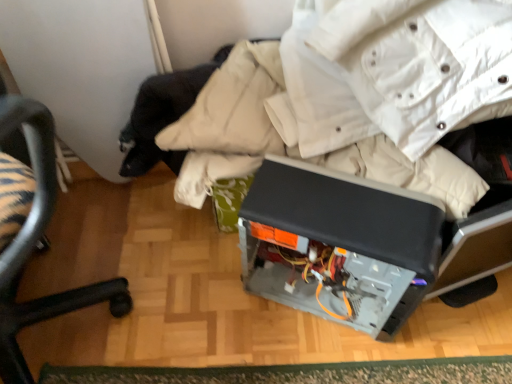
Image resolution: width=512 pixels, height=384 pixels. What do you see at coordinates (37, 242) in the screenshot?
I see `black plastic chair at lower left` at bounding box center [37, 242].

Measure the distance between green textured mat at lower center and camera.

green textured mat at lower center and camera are 38.49 inches apart.

This screenshot has width=512, height=384. What do you see at coordinates (298, 373) in the screenshot? I see `green textured mat at lower center` at bounding box center [298, 373].

Image resolution: width=512 pixels, height=384 pixels. Find the location of `satin black computer case at center`. satin black computer case at center is located at coordinates (361, 244).

From the image's perspective, is satin black computer case at center located above green textured mat at lower center?

Yes.

In the scene shown: Would you say satin black computer case at center is inside or outside green textured mat at lower center?

satin black computer case at center cannot be found inside green textured mat at lower center.

Considering the sizes of objects satin black computer case at center and green textured mat at lower center in the image provided, who is bigger, satin black computer case at center or green textured mat at lower center?

satin black computer case at center is bigger.

In terms of width, does satin black computer case at center look wider or thinner when compared to green textured mat at lower center?

satin black computer case at center is wider than green textured mat at lower center.

Could satin black computer case at center be considered to be inside black plastic chair at lower left?

No, satin black computer case at center is not surrounded by black plastic chair at lower left.

From the image's perspective, is black plastic chair at lower left positioned above or below satin black computer case at center?

black plastic chair at lower left is above satin black computer case at center.

From the picture: Relative to satin black computer case at center, is black plastic chair at lower left in front or behind?

In the image, black plastic chair at lower left appears in front of satin black computer case at center.

At what (x,y) coordinates should I click in order to perform the action: click on mat that is below the satin black computer case at center (from the image's perspective). Please return your answer as a coordinate pair (x, y). This screenshot has height=384, width=512. Looking at the image, I should click on (298, 373).

Which is more to the left, green textured mat at lower center or satin black computer case at center?

green textured mat at lower center is more to the left.

Based on the photo, how distant is green textured mat at lower center from satin black computer case at center?

A distance of 11.66 inches exists between green textured mat at lower center and satin black computer case at center.

Which object is thinner, green textured mat at lower center or satin black computer case at center?

With smaller width is green textured mat at lower center.

How many degrees apart are the facing directions of black plastic chair at lower left and green textured mat at lower center?

21.3 degrees separate the facing orientations of black plastic chair at lower left and green textured mat at lower center.

From the image's perspective, which one is positioned higher, black plastic chair at lower left or green textured mat at lower center?

black plastic chair at lower left, from the image's perspective.

Visually, is black plastic chair at lower left positioned to the left or to the right of green textured mat at lower center?

Clearly, black plastic chair at lower left is on the left of green textured mat at lower center in the image.

Who is bigger, black plastic chair at lower left or green textured mat at lower center?

Bigger between the two is black plastic chair at lower left.

Which object is positioned more to the right, green textured mat at lower center or black plastic chair at lower left?

green textured mat at lower center is more to the right.

From a real-world perspective, is green textured mat at lower center physically above black plastic chair at lower left?

Actually, green textured mat at lower center is physically below black plastic chair at lower left in the real world.

Identify the location of chair lying in front of the green textured mat at lower center. (37, 242).

How different are the orientations of satin black computer case at center and black plastic chair at lower left in degrees?

satin black computer case at center and black plastic chair at lower left are facing 91.4 degrees away from each other.

Considering the sizes of objects satin black computer case at center and black plastic chair at lower left in the image provided, who is shorter, satin black computer case at center or black plastic chair at lower left?

With less height is satin black computer case at center.

Is satin black computer case at center not close to black plastic chair at lower left?

No, satin black computer case at center is not far away from black plastic chair at lower left.

Is satin black computer case at center facing away from black plastic chair at lower left?

No, satin black computer case at center is not facing away from black plastic chair at lower left.

This screenshot has height=384, width=512. In order to click on mat below the satin black computer case at center (from a real-world perspective) in this screenshot , I will do `click(298, 373)`.

In the image, there is a satin black computer case at center. Where is `chair above it (from the image's perspective)`? The width and height of the screenshot is (512, 384). chair above it (from the image's perspective) is located at coordinates (37, 242).

Looking at the image, which one is located closer to green textured mat at lower center, black plastic chair at lower left or satin black computer case at center?

satin black computer case at center lies closer to green textured mat at lower center than the other object.

Based on the photo, from the image, which object appears to be nearer to green textured mat at lower center, satin black computer case at center or black plastic chair at lower left?

The object closer to green textured mat at lower center is satin black computer case at center.

Which object lies further to the anchor point black plastic chair at lower left, green textured mat at lower center or satin black computer case at center?

The object further to black plastic chair at lower left is satin black computer case at center.

Which object lies nearer to the anchor point satin black computer case at center, black plastic chair at lower left or green textured mat at lower center?

Among the two, green textured mat at lower center is located nearer to satin black computer case at center.

From the image, which object appears to be nearer to satin black computer case at center, green textured mat at lower center or black plastic chair at lower left?

Among the two, green textured mat at lower center is located nearer to satin black computer case at center.

When comparing their distances from black plastic chair at lower left, does satin black computer case at center or green textured mat at lower center seem further?

satin black computer case at center lies further to black plastic chair at lower left than the other object.

Find the location of `wide between black plastic chair at lower left and green textured mat at lower center in the front-back direction`. wide between black plastic chair at lower left and green textured mat at lower center in the front-back direction is located at coordinates (361, 244).